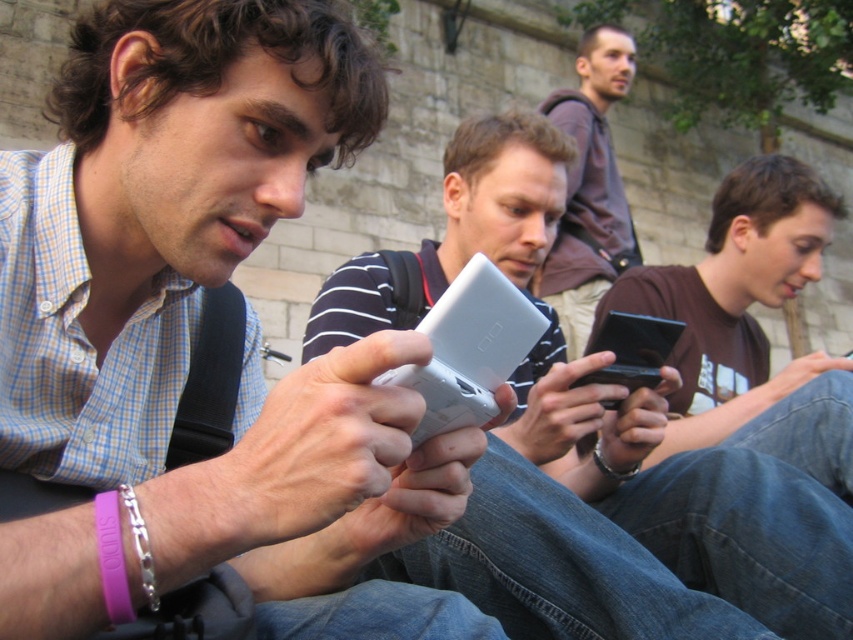
Which is in front, point (619, 445) or point (595, 376)?

Point (595, 376) is in front.

The height and width of the screenshot is (640, 853). What do you see at coordinates (688, 508) in the screenshot?
I see `silver plastic phone at center` at bounding box center [688, 508].

Locate an element on the screen. silver plastic phone at center is located at coordinates (688, 508).

Based on the photo, can you confirm if matte black phone at center is wider than black glossy smartphone at center?

Indeed, matte black phone at center has a greater width compared to black glossy smartphone at center.

Between point (848, 406) and point (647, 384), which one is positioned in front?

Point (848, 406) is more forward.

The width and height of the screenshot is (853, 640). In order to click on matte black phone at center in this screenshot , I will do `click(750, 324)`.

Is matte black phone at center to the right of brown hoodie at upper center from the viewer's perspective?

Incorrect, matte black phone at center is not on the right side of brown hoodie at upper center.

Is matte black phone at center above brown hoodie at upper center?

Actually, matte black phone at center is below brown hoodie at upper center.

Identify the location of matte black phone at center. (750, 324).